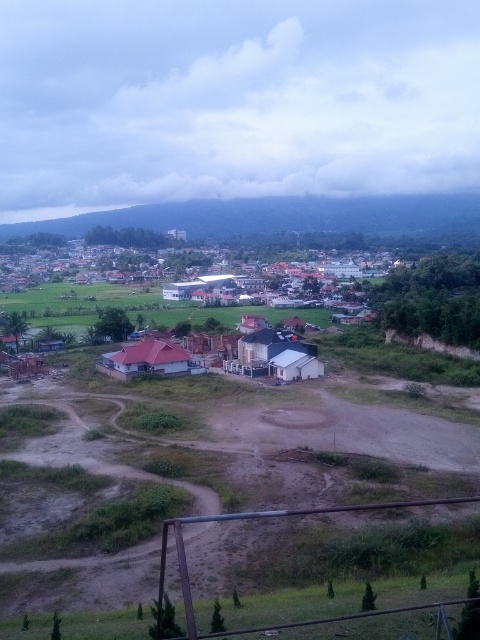
You are standing on the balcony overlooking the scene. You see the dull brown dirt field at center and the white matte house at center. Which object is positioned to the right of the other?

The dull brown dirt field at center is to the right of the white matte house at center.